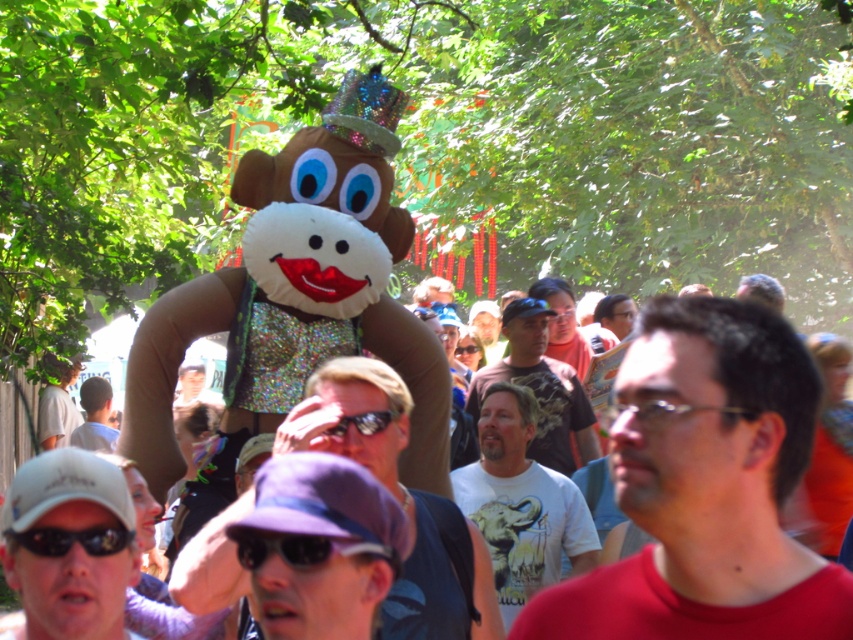
You are organizing a photo shoot and need to ensure that the white matte cap at lower left and the light blue shirt at center are both visible in the frame. Given their sizes, which object should you focus on to ensure both are in the shot without cropping?

The white matte cap at lower left has a lesser width compared to light blue shirt at center. Therefore, you should focus on framing around the larger light blue shirt at center to ensure both objects fit within the shot.

You are a photographer trying to capture a candid shot of the light blue shirt at center without including the white matte cap at lower left. Based on their positions, is this possible?

The white matte cap at lower left is positioned on the right side of light blue shirt at center, so if you position yourself to the left side of the light blue shirt at center, you can exclude the white matte cap at lower left from the frame.